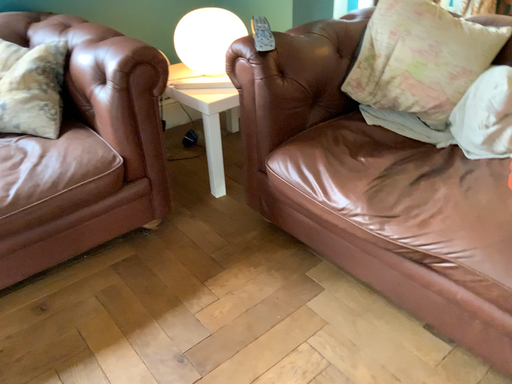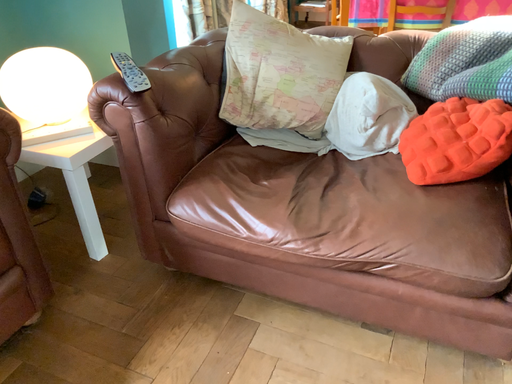
Question: How did the camera likely rotate when shooting the video?

Choices:
 (A) rotated left
 (B) rotated right

Answer: (B)